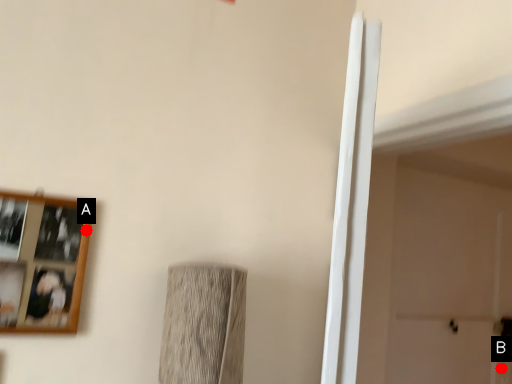
Question: Two points are circled on the image, labeled by A and B beside each circle. Which point is closer to the camera?

Choices:
 (A) A is closer
 (B) B is closer

Answer: (A)